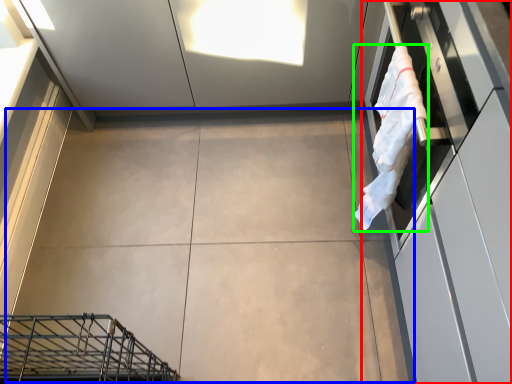
Question: Which object is the closest to the cabinetry (highlighted by a red box)? Choose among these: concrete (highlighted by a blue box) or laundry (highlighted by a green box).

Choices:
 (A) concrete
 (B) laundry

Answer: (B)